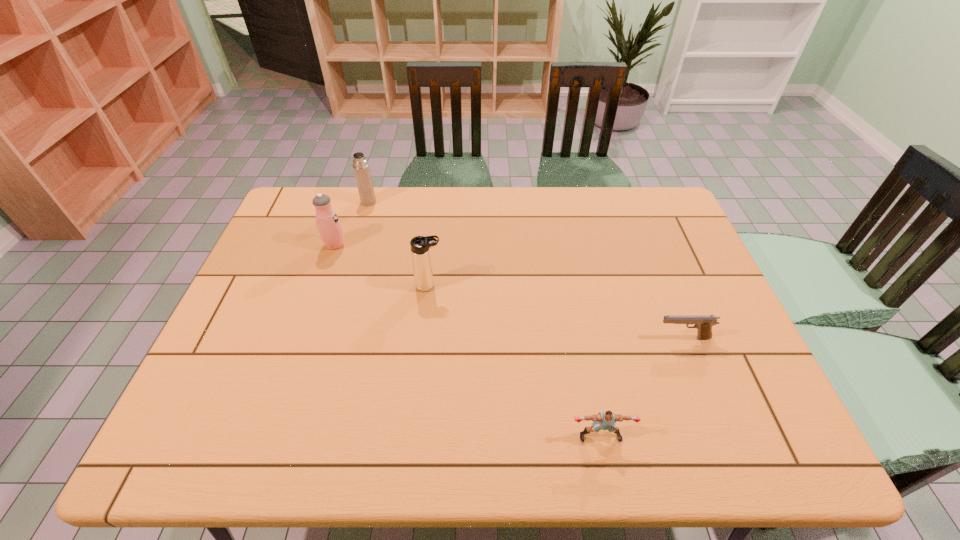
Where is `vacant region located on the back of the fourth nearest object`? The width and height of the screenshot is (960, 540). vacant region located on the back of the fourth nearest object is located at coordinates (353, 191).

At what (x,y) coordinates should I click in order to perform the action: click on vacant space located 0.340m on the front of the second object from left to right. Please return your answer as a coordinate pair (x, y). This screenshot has width=960, height=540. Looking at the image, I should click on (346, 279).

Locate an element on the screen. vacant space located on the handle side of the third nearest object is located at coordinates click(461, 286).

Where is `vacant space located 0.180m at the barrel of the rightmost object`? The image size is (960, 540). vacant space located 0.180m at the barrel of the rightmost object is located at coordinates (584, 338).

The image size is (960, 540). In order to click on free spot located at the barrel of the rightmost object in this screenshot , I will do `click(552, 338)`.

Identify the location of vacant space situated at the barrel of the rightmost object. This screenshot has width=960, height=540. (552, 338).

Identify the location of object located at the far edge. The width and height of the screenshot is (960, 540). (361, 168).

The width and height of the screenshot is (960, 540). I want to click on object at the near edge, so click(x=606, y=420).

Where is `object that is positioned at the right edge`? This screenshot has width=960, height=540. object that is positioned at the right edge is located at coordinates (703, 323).

You are a GUI agent. You are given a task and a screenshot of the screen. Output one action in this format:
    pyautogui.click(x=<x>, y=<y>)
    Task: Click on the vacant space at the far edge of the desktop
    This screenshot has width=960, height=540.
    Given the screenshot: What is the action you would take?
    pyautogui.click(x=402, y=211)